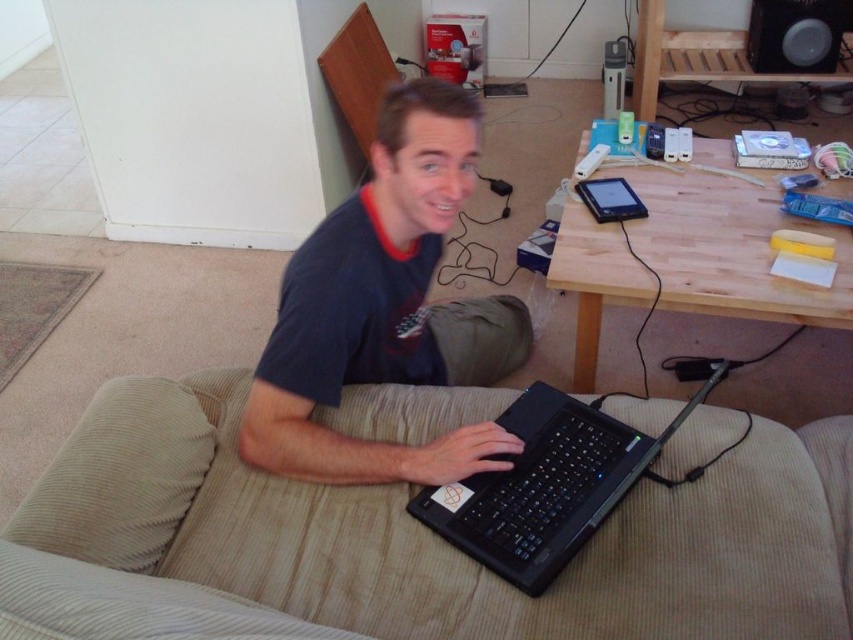
You are setting up a small desk in your room and need to place both the matte black laptop at center and the black plastic speaker at upper right on it. Given their sizes, which object should you place first to ensure they both fit properly?

Since the matte black laptop at center is wider than the black plastic speaker at upper right, you should place the wider matte black laptop at center first to ensure there is enough space for both items on the desk.

You are a delivery person who needs to place a small package between the beige corduroy couch at center and the black plastic speaker at upper right. Given that the package requires at least 1.5 meters of space to fit, will there be enough space between them?

The beige corduroy couch at center is 2.10 meters away from the black plastic speaker at upper right. Since the required space is 1.5 meters, there is sufficient space to place the package between them.

You are trying to decide whether to place a new tablet next to the matte black laptop at center and the khaki fabric pants at lower center on the couch. Considering their sizes, which object should you place the tablet next to to ensure it fits comfortably?

The matte black laptop at center is bigger than the khaki fabric pants at lower center, so placing the tablet next to the khaki fabric pants at lower center would leave more space for the tablet to fit comfortably.